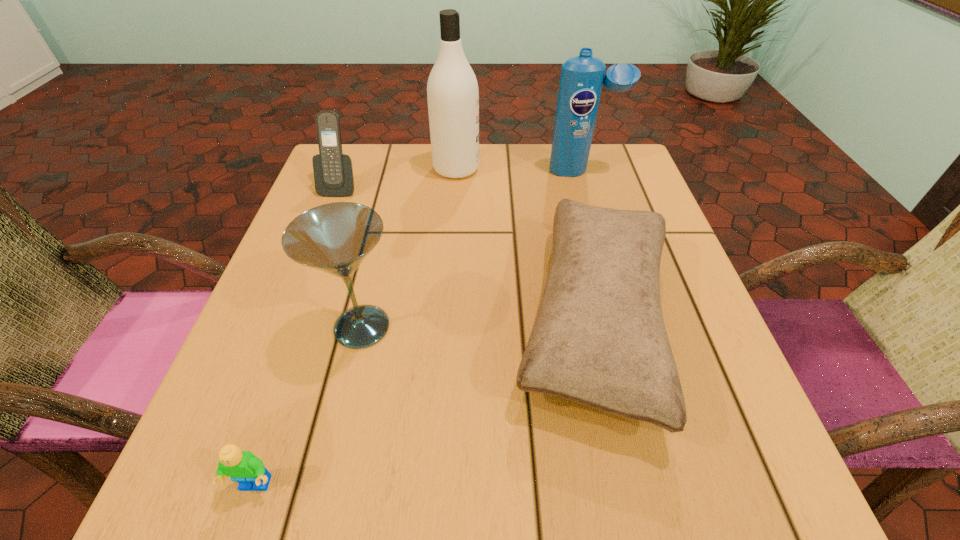
The image size is (960, 540). Identify the location of vacant space located on the left of the second tallest object. (512, 171).

Locate an element on the screen. The width and height of the screenshot is (960, 540). vacant space located on the right of the martini is located at coordinates (575, 327).

The image size is (960, 540). Identify the location of vacant space located 0.230m on the front-facing side of the fourth tallest object. (308, 270).

In order to click on vacant space located 0.130m on the left of the fifth tallest object in this screenshot , I will do `click(432, 320)`.

The height and width of the screenshot is (540, 960). What are the coordinates of `cellular telephone located in the far edge section of the desktop` in the screenshot? It's located at (333, 171).

Identify the location of cushion at the near edge. This screenshot has width=960, height=540. (599, 339).

Locate an element on the screen. The width and height of the screenshot is (960, 540). Lego present at the near edge is located at coordinates (244, 467).

Locate an element on the screen. The height and width of the screenshot is (540, 960). martini located in the left edge section of the desktop is located at coordinates (335, 238).

Find the location of a particular element. cellular telephone that is positioned at the left edge is located at coordinates (333, 171).

Where is `Lego situated at the left edge`? This screenshot has height=540, width=960. Lego situated at the left edge is located at coordinates (244, 467).